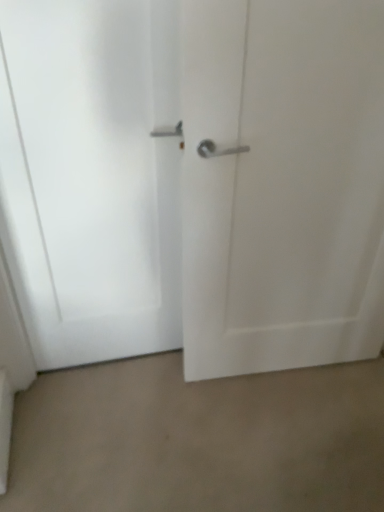
Image resolution: width=384 pixels, height=512 pixels. What do you see at coordinates (198, 439) in the screenshot?
I see `beige carpet at lower center` at bounding box center [198, 439].

At what (x,y) coordinates should I click in order to perform the action: click on beige carpet at lower center. Please return your answer as a coordinate pair (x, y). This screenshot has width=384, height=512. Looking at the image, I should click on pyautogui.click(x=198, y=439).

This screenshot has height=512, width=384. Find the location of `beige carpet at lower center`. beige carpet at lower center is located at coordinates (198, 439).